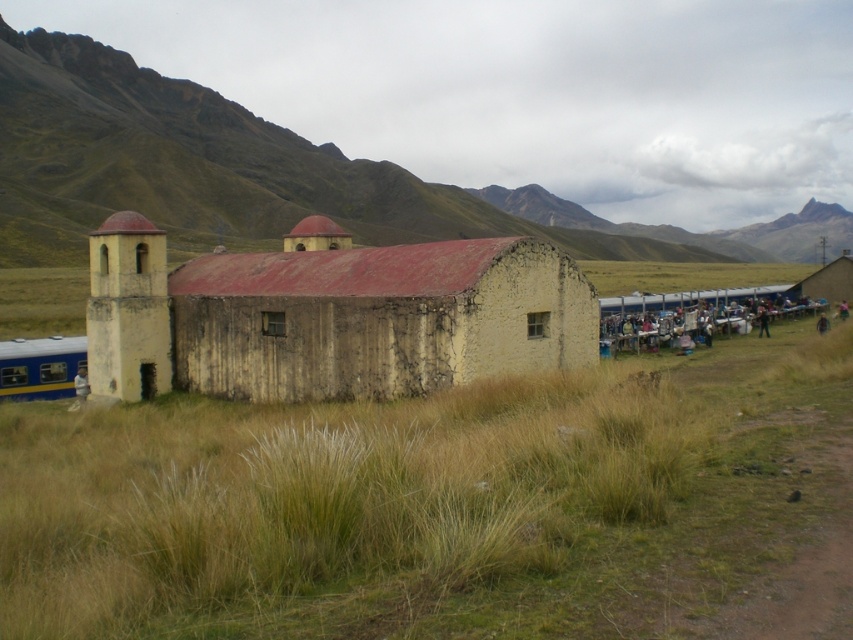
You are standing in front of the rustic building and notice the rugged stone mountain at upper left and the white plastic chairs at right. From your perspective, which object is positioned to the right of the other?

The rugged stone mountain at upper left is positioned to the right of the white plastic chairs at right.

You are a hiker who wants to take a photo of the dry grass at center and the rugged stone mountain at upper left. From your current position, which object is closer to the camera?

The dry grass at center is closer to the camera because it is located below the rugged stone mountain at upper left, indicating it is in the foreground.